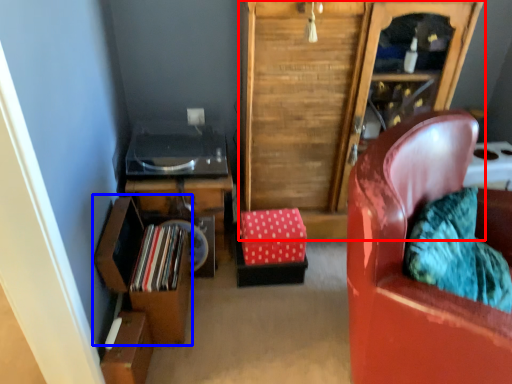
Question: Which point is further to the camera, cabinetry (highlighted by a red box) or shelf (highlighted by a blue box)?

Choices:
 (A) cabinetry
 (B) shelf

Answer: (B)